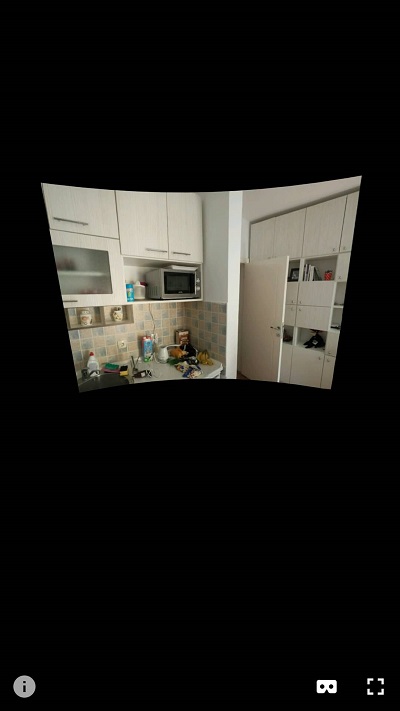
Where is `white cabinets`? The height and width of the screenshot is (711, 400). white cabinets is located at coordinates (156, 224), (95, 215), (99, 266), (307, 237), (312, 365), (301, 299).